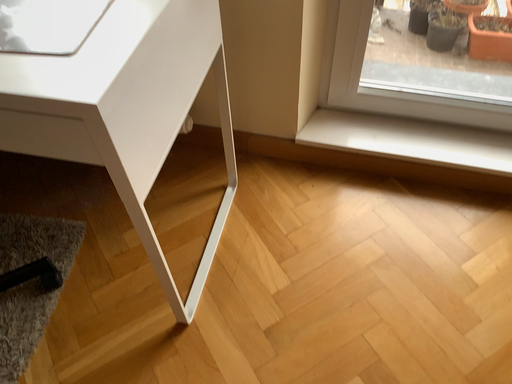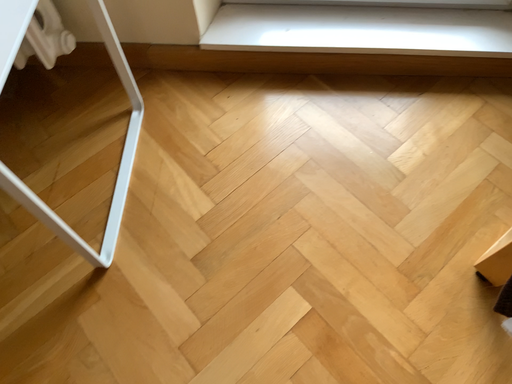
Question: Which way did the camera rotate in the video?

Choices:
 (A) rotated left
 (B) rotated right

Answer: (B)